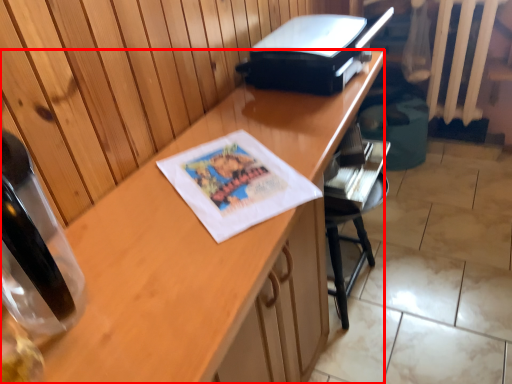
Question: Observing the image, what is the correct spatial positioning of desk (annotated by the red box) in reference to printer?

Choices:
 (A) left
 (B) right

Answer: (A)